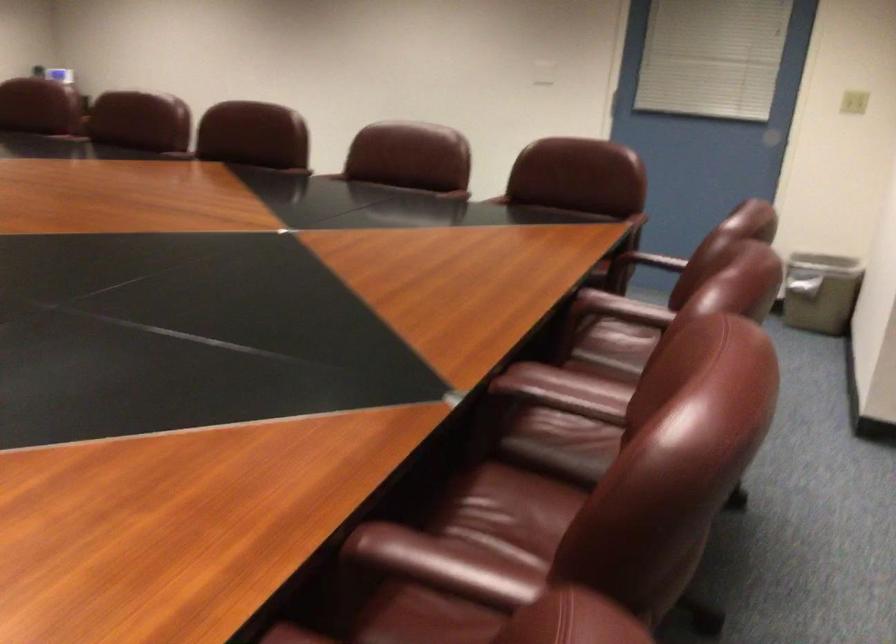
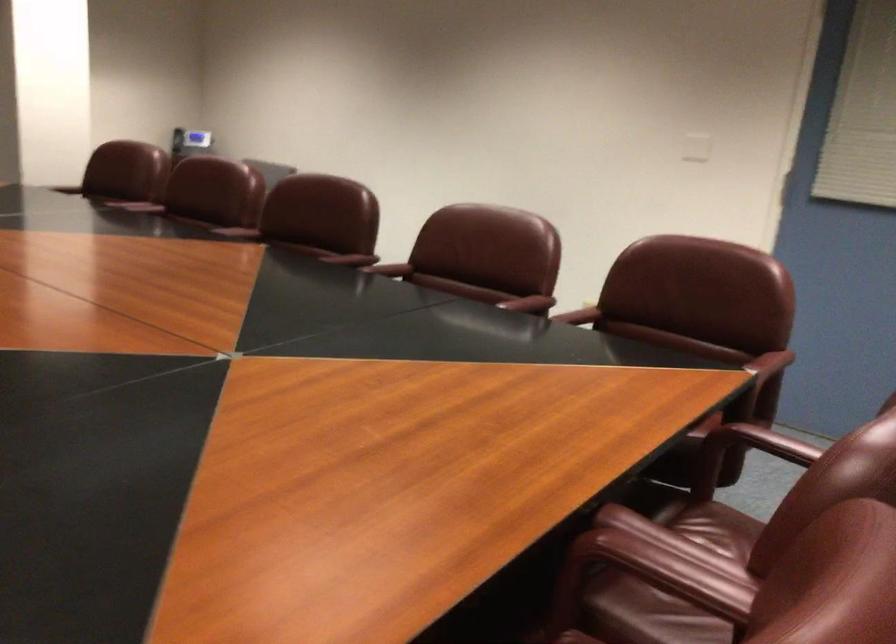
Find the pixel in the second image that matches [641,214] in the first image.

(769, 362)